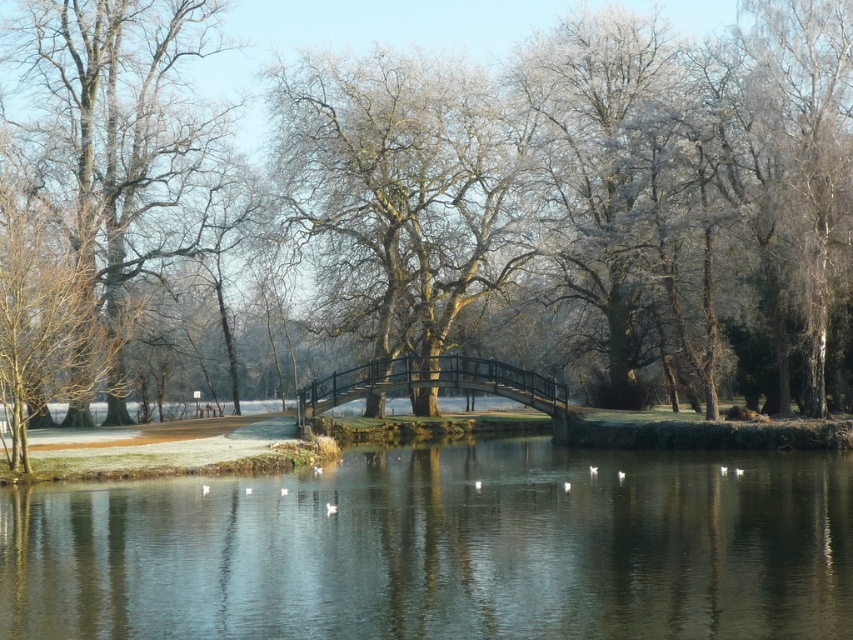
Is point (347, 266) less distant than point (312, 387)?

No.

Between frosty bark tree at center and black metal bridge at center, which one is positioned lower?

Positioned lower is black metal bridge at center.

Is point (403, 362) behind point (544, 378)?

Yes.

Where is `frosty bark tree at center`? The width and height of the screenshot is (853, 640). frosty bark tree at center is located at coordinates (396, 208).

Can you confirm if smooth brown tree at left is thinner than black metal bridge at center?

Incorrect, smooth brown tree at left's width is not less than black metal bridge at center's.

From the picture: Is smooth brown tree at left further to the viewer compared to black metal bridge at center?

No, it is in front of black metal bridge at center.

I want to click on smooth brown tree at left, so click(x=119, y=156).

Is frosty bark tree at center wider than smooth brown tree at left?

Yes.

Does frosty bark tree at center appear under smooth brown tree at left?

Correct, frosty bark tree at center is located below smooth brown tree at left.

Does point (401, 380) come in front of point (137, 221)?

Yes, it is in front of point (137, 221).

The height and width of the screenshot is (640, 853). I want to click on frosty bark tree at center, so click(396, 208).